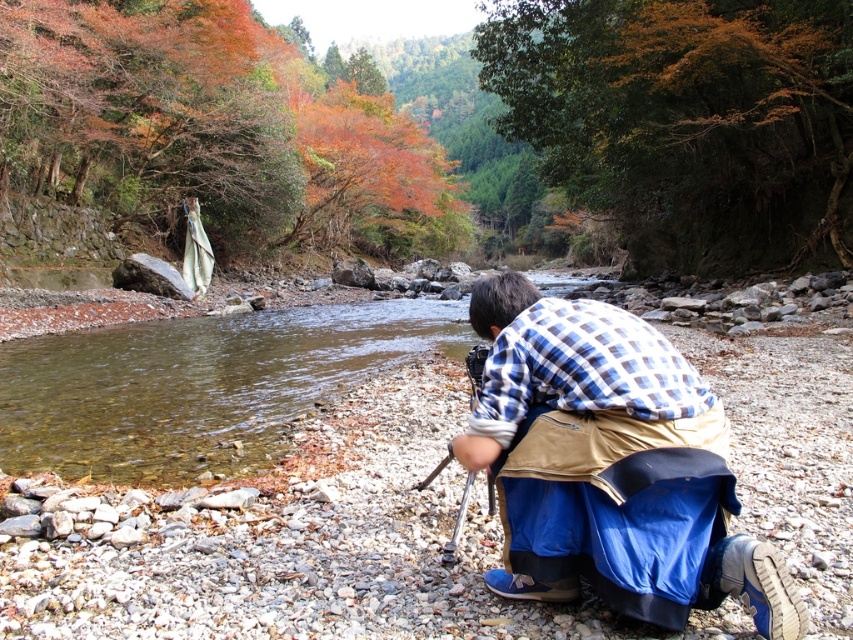
Find the location of a particular element. blue plaid shirt at center is located at coordinates (607, 464).

Does blue plaid shirt at center lie behind clear water at stream center?

No, it is not.

Describe the element at coordinates (607, 464) in the screenshot. I see `blue plaid shirt at center` at that location.

Identify the location of blue plaid shirt at center. (607, 464).